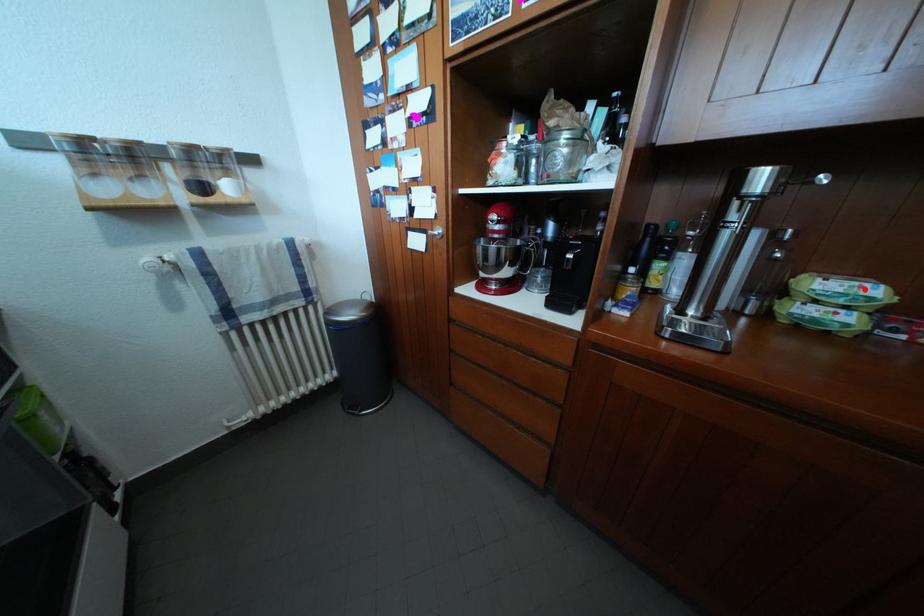
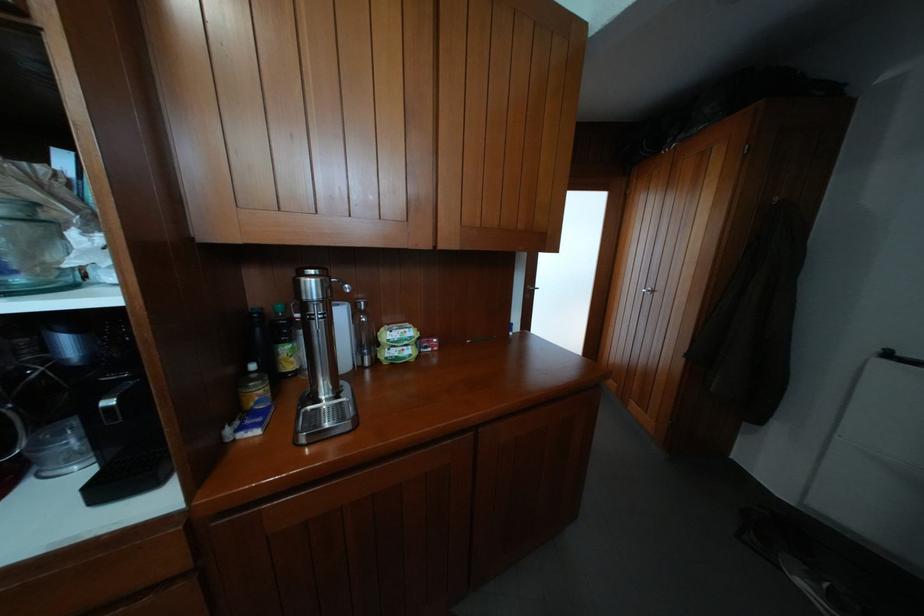
Find the pixel in the second image that matches the highlighted location in the first image.

(411, 336)